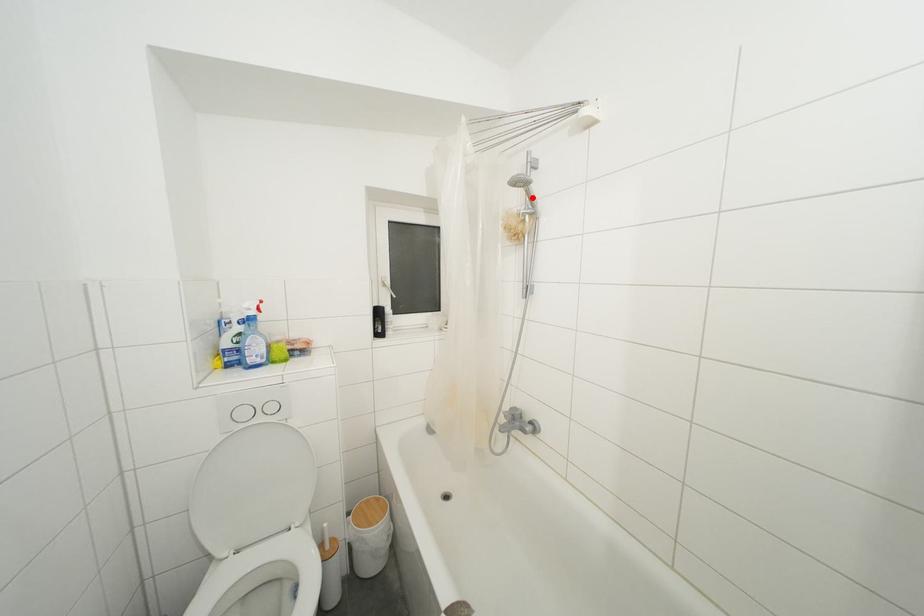
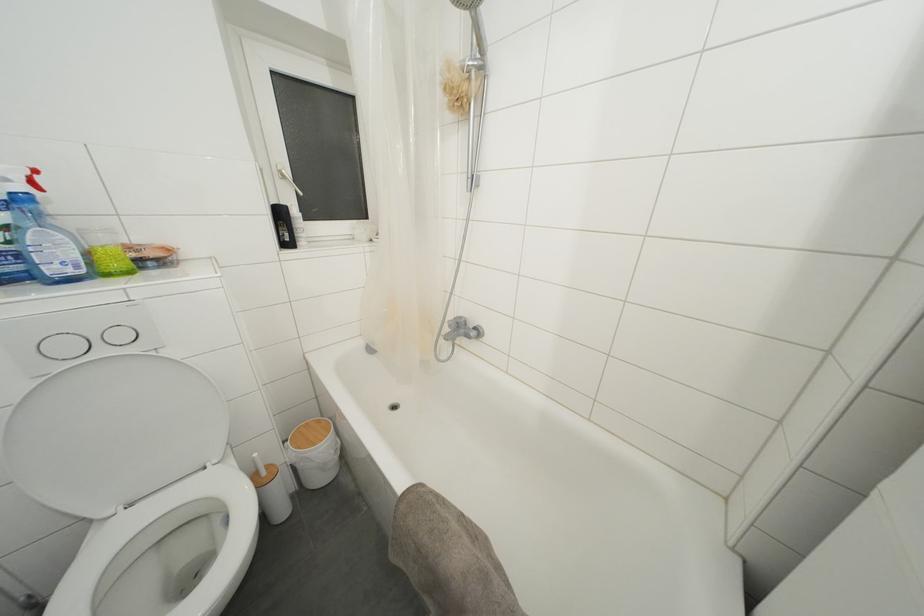
In the second image, find the point that corresponds to the highlighted location in the first image.

(480, 31)